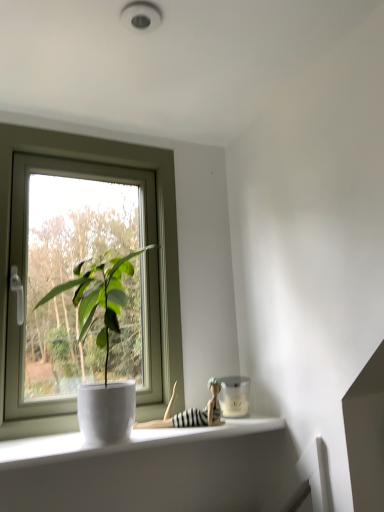
Identify the location of vacant space underneath white glossy pot at window (from a real-world perspective). The image size is (384, 512). (92, 443).